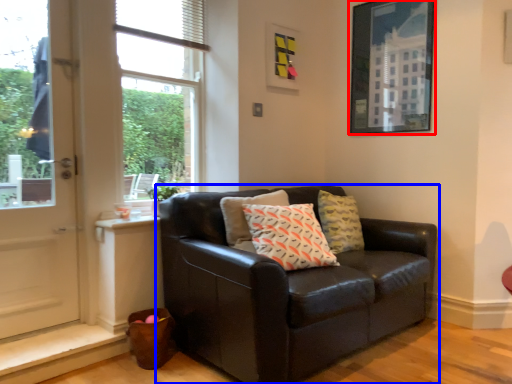
Question: Which object appears farthest to the camera in this image, picture frame (highlighted by a red box) or studio couch (highlighted by a blue box)?

Choices:
 (A) picture frame
 (B) studio couch

Answer: (A)